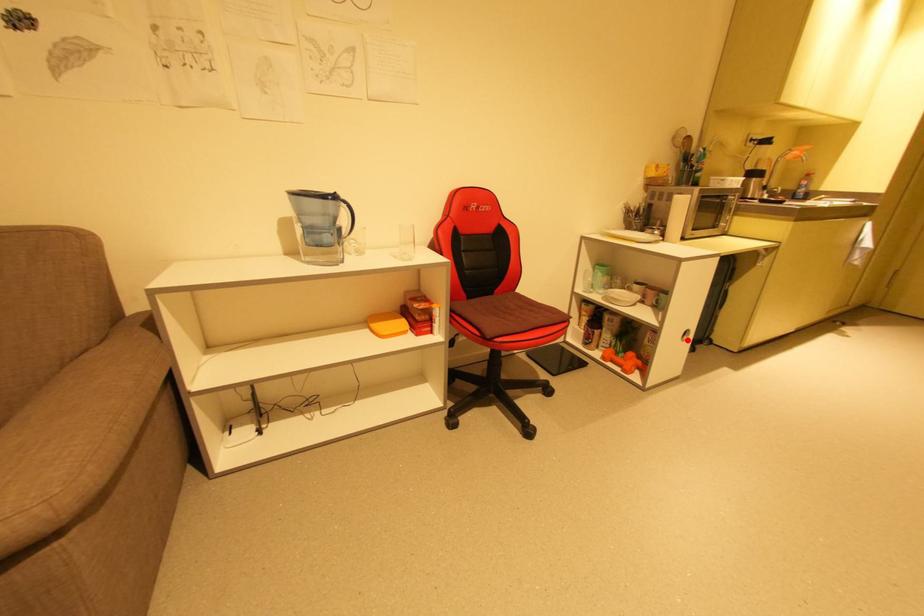
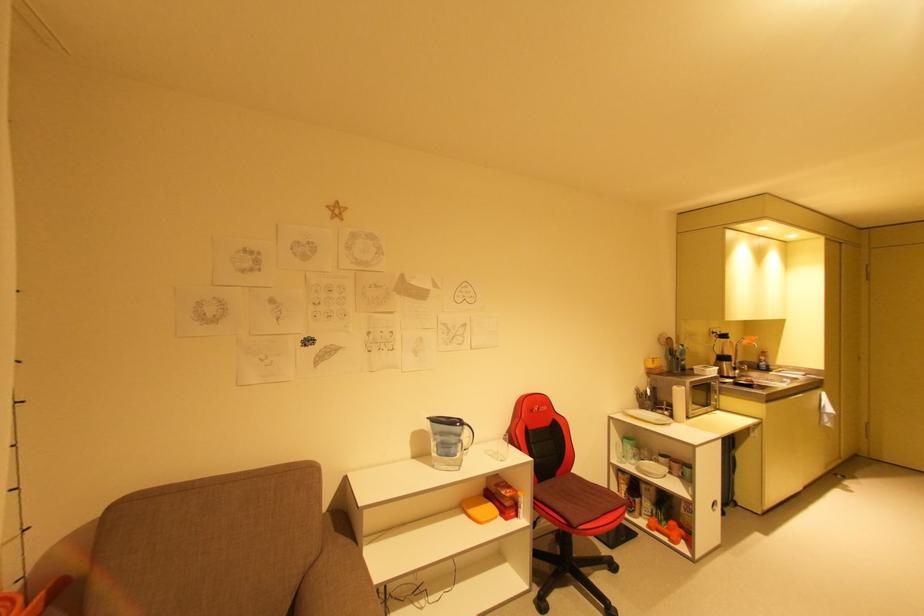
Question: I am providing you with two images of the same scene from different viewpoints. In image1, a red point is highlighted. Considering the same 3D point in image2, which of the following is correct?

Choices:
 (A) It is closer
 (B) It is farther

Answer: (A)